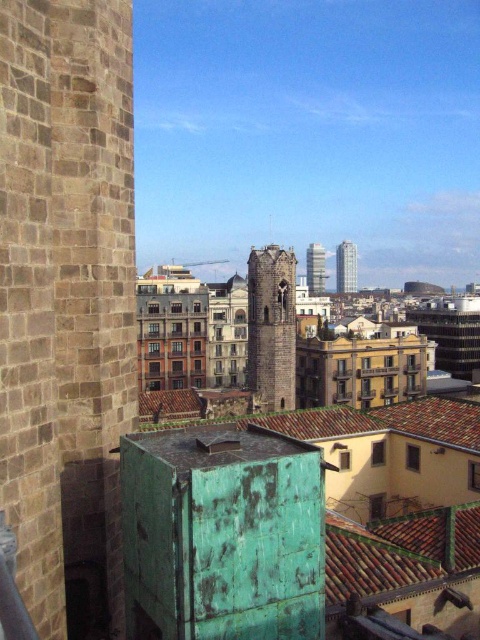
Between glassy reflective skyscraper at upper right and glassy reflective skyscraper at center, which one has less height?

glassy reflective skyscraper at upper right

Can you confirm if glassy reflective skyscraper at upper right is thinner than glassy reflective skyscraper at center?

Yes.

Between point (342, 268) and point (316, 244), which one is positioned behind?

The point (316, 244) is behind.

You are a GUI agent. You are given a task and a screenshot of the screen. Output one action in this format:
    pyautogui.click(x=<x>, y=<y>)
    Task: Click on the glassy reflective skyscraper at upper right
    
    Given the screenshot: What is the action you would take?
    pyautogui.click(x=346, y=268)

In the scene shown: Which of these two, brown stone tower at center or glassy reflective skyscraper at upper right, stands shorter?

With less height is brown stone tower at center.

Is brown stone tower at center below glassy reflective skyscraper at upper right?

Yes, brown stone tower at center is below glassy reflective skyscraper at upper right.

What do you see at coordinates (271, 326) in the screenshot?
I see `brown stone tower at center` at bounding box center [271, 326].

Where is `brown stone tower at center`? The height and width of the screenshot is (640, 480). brown stone tower at center is located at coordinates (271, 326).

Which is in front, point (283, 330) or point (320, 244)?

Positioned in front is point (283, 330).

Which is more to the left, brown stone tower at center or glassy reflective skyscraper at center?

brown stone tower at center is more to the left.

Identify the location of brown stone tower at center. (271, 326).

This screenshot has width=480, height=640. What are the coordinates of `brown stone tower at center` in the screenshot? It's located at (271, 326).